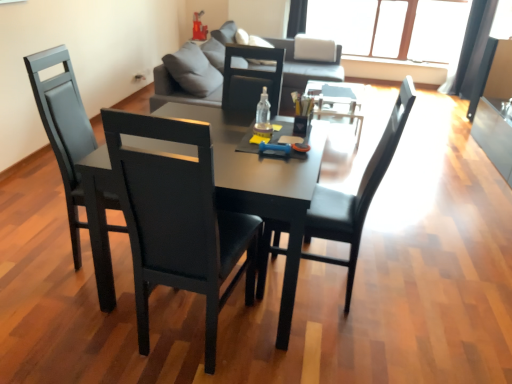
Where is `vacant space in front of transparent plastic bottle at center`? The image size is (512, 384). vacant space in front of transparent plastic bottle at center is located at coordinates (265, 135).